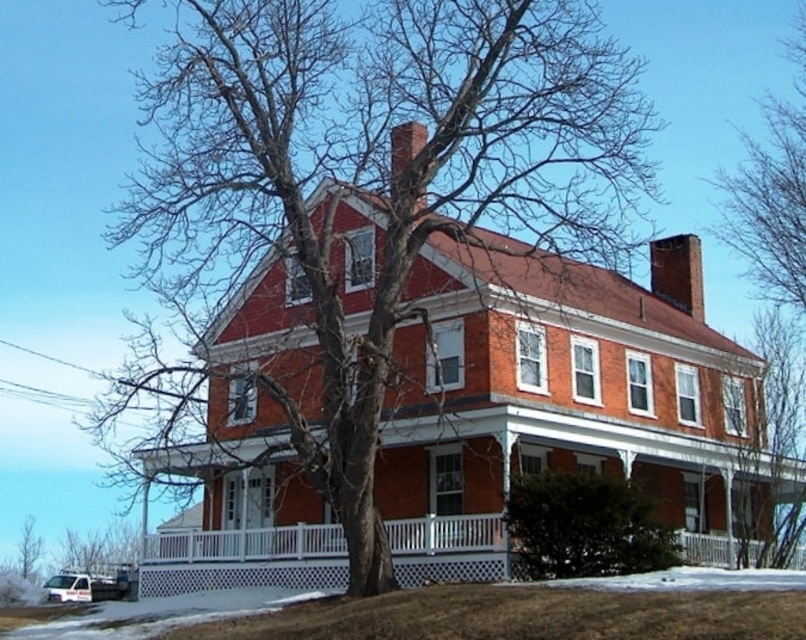
Does bare branches at center have a lesser width compared to smooth brick chimney at upper center?

Incorrect, bare branches at center's width is not less than smooth brick chimney at upper center's.

Is point (327, 134) farther from viewer compared to point (393, 147)?

That is True.

Does point (455, 4) lie behind point (393, 164)?

No, it is in front of (393, 164).

In order to click on bare branches at center in this screenshot , I will do `click(376, 179)`.

From the picture: Who is shorter, smooth brick chimney at upper right or smooth brick chimney at upper center?

With less height is smooth brick chimney at upper center.

Is point (698, 273) closer to viewer compared to point (397, 179)?

No.

Who is more distant from viewer, (667, 248) or (399, 138)?

Point (667, 248)

Find the location of a particular element. The height and width of the screenshot is (640, 806). smooth brick chimney at upper right is located at coordinates coord(676,273).

Who is positioned more to the right, smooth brick chimney at upper center or bare branches at lower left?

smooth brick chimney at upper center

Who is shorter, smooth brick chimney at upper center or bare branches at lower left?

bare branches at lower left

Between point (395, 196) and point (31, 515), which one is positioned behind?

The point (31, 515) is behind.

Locate an element on the screen. The height and width of the screenshot is (640, 806). smooth brick chimney at upper center is located at coordinates (404, 148).